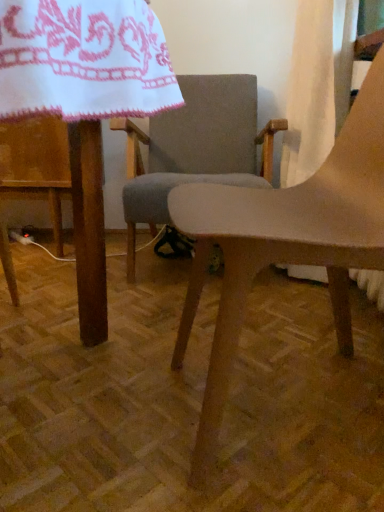
Question: Is white embroidered cloth at upper left wider or thinner than matte wood chair at center, the second chair viewed from the back?

Choices:
 (A) wide
 (B) thin

Answer: (A)

Question: Considering the positions of white embroidered cloth at upper left and matte wood chair at center, the 1th chair when ordered from front to back, in the image, is white embroidered cloth at upper left taller or shorter than matte wood chair at center, the 1th chair when ordered from front to back,?

Choices:
 (A) short
 (B) tall

Answer: (A)

Question: Considering the real-world distances, which object is farthest from the matte wood table at center?

Choices:
 (A) matte wood chair at center, the second chair viewed from the back
 (B) gray fabric chair at center, positioned as the 2th chair in front-to-back order
 (C) white embroidered cloth at upper left
 (D) white fabric curtain at upper right

Answer: (D)

Question: Estimate the real-world distances between objects in this image. Which object is closer to the matte wood chair at center, the second chair viewed from the back?

Choices:
 (A) matte wood table at center
 (B) white embroidered cloth at upper left
 (C) gray fabric chair at center, positioned as the 2th chair in front-to-back order
 (D) white fabric curtain at upper right

Answer: (B)